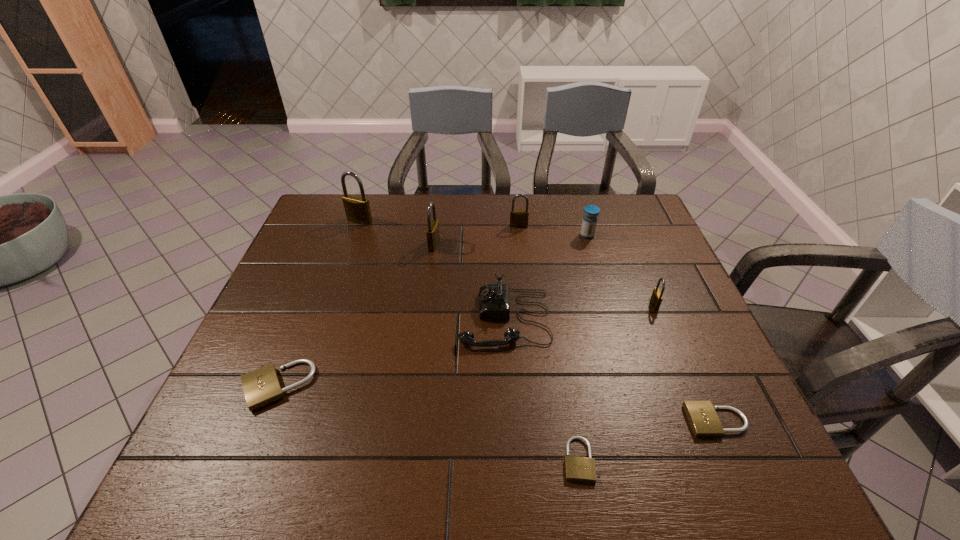
In order to click on telephone in this screenshot , I will do `click(494, 299)`.

The height and width of the screenshot is (540, 960). I want to click on the leftmost beige padlock, so (x=261, y=386).

In order to click on the third shortest object in this screenshot , I will do `click(261, 386)`.

Where is `the rightmost beige padlock`? Image resolution: width=960 pixels, height=540 pixels. the rightmost beige padlock is located at coordinates (703, 419).

The image size is (960, 540). In order to click on the second shortest padlock in this screenshot , I will do `click(703, 419)`.

Find the location of a particular element. This screenshot has width=960, height=540. the smallest beige padlock is located at coordinates (580, 469).

Locate an element on the screen. This screenshot has height=540, width=960. the shortest object is located at coordinates (580, 469).

Locate an element on the screen. The width and height of the screenshot is (960, 540). vacant area situated on the front of the biggest brass padlock is located at coordinates (334, 293).

Find the location of a particular element. Image resolution: width=960 pixels, height=540 pixels. vacant space situated on the front of the third farthest padlock is located at coordinates (420, 352).

Image resolution: width=960 pixels, height=540 pixels. Find the location of `vacant space located on the left of the fourth padlock from left to right`. vacant space located on the left of the fourth padlock from left to right is located at coordinates (461, 226).